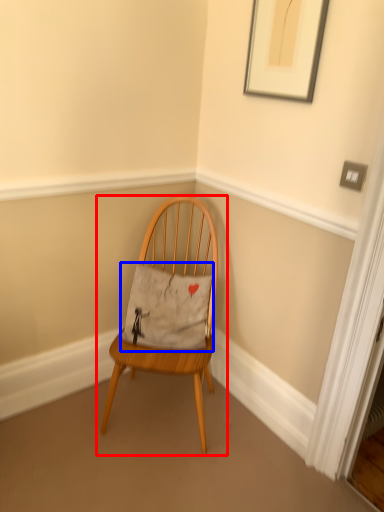
Question: Which point is further to the camera, chair (highlighted by a red box) or pillow (highlighted by a blue box)?

Choices:
 (A) chair
 (B) pillow

Answer: (B)